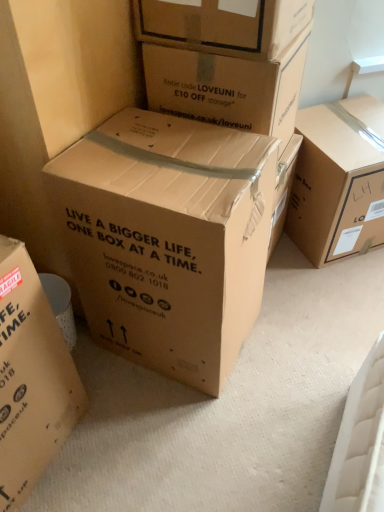
Find the location of a particular element. brown cardboard box at center, which appears as the 6th box when viewed from the right is located at coordinates (31, 378).

Describe the element at coordinates (223, 25) in the screenshot. The width and height of the screenshot is (384, 512). I see `brown cardboard box at upper center, which ranks as the fourth box in left-to-right order` at that location.

Find the location of a particular element. The image size is (384, 512). brown cardboard box at center, placed as the fifth box when sorted from right to left is located at coordinates (57, 102).

Does brown cardboard box at center, the 3th box viewed from the left, have a greater width compared to brown cardboard box at upper right, which is the sixth box in left-to-right order?

Yes.

From the image's perspective, between brown cardboard box at center, the 3th box viewed from the left, and brown cardboard box at upper right, which is the sixth box in left-to-right order, which one is located above?

brown cardboard box at upper right, which is the sixth box in left-to-right order.

This screenshot has width=384, height=512. I want to click on the 1st box above the brown cardboard box at upper right, which is the sixth box in left-to-right order (from a real-world perspective), so click(167, 238).

Is brown cardboard box at center, the 3th box viewed from the left, far away from brown cardboard box at upper right, which is the sixth box in left-to-right order?

No, brown cardboard box at center, the 3th box viewed from the left, is not far away from brown cardboard box at upper right, which is the sixth box in left-to-right order.

Is the surface of brown cardboard box at upper center, the 3th box in the right-to-left sequence, in direct contact with brown cardboard box at upper center, the second box in the right-to-left sequence?

Yes, brown cardboard box at upper center, the 3th box in the right-to-left sequence, is touching brown cardboard box at upper center, the second box in the right-to-left sequence.

Is brown cardboard box at upper center, the 3th box in the right-to-left sequence, wider than brown cardboard box at upper center, the 5th box from the left?

Indeed, brown cardboard box at upper center, the 3th box in the right-to-left sequence, has a greater width compared to brown cardboard box at upper center, the 5th box from the left.

Considering the sizes of objects brown cardboard box at upper center, which ranks as the fourth box in left-to-right order, and brown cardboard box at upper center, the 5th box from the left, in the image provided, who is taller, brown cardboard box at upper center, which ranks as the fourth box in left-to-right order, or brown cardboard box at upper center, the 5th box from the left,?

Standing taller between the two is brown cardboard box at upper center, the 5th box from the left.

From a real-world perspective, is brown cardboard box at upper center, the 3th box in the right-to-left sequence, located higher than brown cardboard box at upper center, the second box in the right-to-left sequence?

Yes, from a real-world perspective, brown cardboard box at upper center, the 3th box in the right-to-left sequence, is on top of brown cardboard box at upper center, the second box in the right-to-left sequence.

From a real-world perspective, count 1st boxs upward from the brown cardboard box at center, the 3th box viewed from the left, and point to it. Please provide its 2D coordinates.

[(31, 378)]

Which is more to the left, brown cardboard box at center, which appears as the 6th box when viewed from the right, or brown cardboard box at center, the 3th box viewed from the left?

brown cardboard box at center, which appears as the 6th box when viewed from the right, is more to the left.

Are brown cardboard box at center, which appears as the 6th box when viewed from the right, and brown cardboard box at center, the fourth box viewed from the right, located far from each other?

No, brown cardboard box at center, which appears as the 6th box when viewed from the right, is not far away from brown cardboard box at center, the fourth box viewed from the right.

Considering the sizes of brown cardboard box at center, which appears as the 6th box when viewed from the right, and brown cardboard box at center, the fourth box viewed from the right, in the image, is brown cardboard box at center, which appears as the 6th box when viewed from the right, bigger or smaller than brown cardboard box at center, the fourth box viewed from the right,?

brown cardboard box at center, which appears as the 6th box when viewed from the right, is smaller than brown cardboard box at center, the fourth box viewed from the right.

From the image's perspective, who appears lower, brown cardboard box at upper center, the 5th box from the left, or brown cardboard box at center, which ranks as the second box in left-to-right order?

From the image's view, brown cardboard box at center, which ranks as the second box in left-to-right order, is below.

Can you confirm if brown cardboard box at upper center, the 5th box from the left, is thinner than brown cardboard box at center, placed as the fifth box when sorted from right to left?

Correct, the width of brown cardboard box at upper center, the 5th box from the left, is less than that of brown cardboard box at center, placed as the fifth box when sorted from right to left.

Based on their positions, is brown cardboard box at upper center, the 5th box from the left, located to the left or right of brown cardboard box at center, which ranks as the second box in left-to-right order?

Clearly, brown cardboard box at upper center, the 5th box from the left, is on the right of brown cardboard box at center, which ranks as the second box in left-to-right order, in the image.

Is brown cardboard box at center, the 3th box viewed from the left, oriented towards brown cardboard box at center, which ranks as the second box in left-to-right order?

No, brown cardboard box at center, the 3th box viewed from the left, is not oriented towards brown cardboard box at center, which ranks as the second box in left-to-right order.

Starting from the brown cardboard box at center, the fourth box viewed from the right, which box is the 1st one in front? Please provide its 2D coordinates.

[(57, 102)]

Considering the positions of points (198, 287) and (14, 141), is point (198, 287) farther from camera compared to point (14, 141)?

No, (198, 287) is in front of (14, 141).

Which of these two, brown cardboard box at center, the 3th box viewed from the left, or brown cardboard box at center, placed as the fifth box when sorted from right to left, is smaller?

brown cardboard box at center, the 3th box viewed from the left.

From the image's perspective, is brown cardboard box at upper center, the 5th box from the left, located beneath brown cardboard box at upper center, the 3th box in the right-to-left sequence?

Correct, brown cardboard box at upper center, the 5th box from the left, appears lower than brown cardboard box at upper center, the 3th box in the right-to-left sequence, in the image.

Does point (171, 67) come behind point (192, 37)?

Yes, it is behind point (192, 37).

Does brown cardboard box at upper center, the 5th box from the left, have a lesser height compared to brown cardboard box at upper center, which ranks as the fourth box in left-to-right order?

No.

Would you say brown cardboard box at upper center, the 5th box from the left, is a long distance from brown cardboard box at upper center, which ranks as the fourth box in left-to-right order?

Actually, brown cardboard box at upper center, the 5th box from the left, and brown cardboard box at upper center, which ranks as the fourth box in left-to-right order, are a little close together.

Between brown cardboard box at center, which appears as the 6th box when viewed from the right, and brown cardboard box at upper right, acting as the first box starting from the right, which one appears on the right side from the viewer's perspective?

Positioned to the right is brown cardboard box at upper right, acting as the first box starting from the right.

From the image's perspective, between brown cardboard box at center, which appears as the 6th box when viewed from the right, and brown cardboard box at upper right, which is the sixth box in left-to-right order, who is located below?

brown cardboard box at center, which appears as the 6th box when viewed from the right.

Does brown cardboard box at center, which is the first box in left-to-right order, have a lesser width compared to brown cardboard box at upper right, acting as the first box starting from the right?

Indeed, brown cardboard box at center, which is the first box in left-to-right order, has a lesser width compared to brown cardboard box at upper right, acting as the first box starting from the right.

Image resolution: width=384 pixels, height=512 pixels. I want to click on the 3rd box counting from the left side of the brown cardboard box at upper right, which is the sixth box in left-to-right order, so click(167, 238).

Where is `box that is the 1st one when counting downward from the brown cardboard box at upper center, which ranks as the fourth box in left-to-right order (from the image's perspective)`? box that is the 1st one when counting downward from the brown cardboard box at upper center, which ranks as the fourth box in left-to-right order (from the image's perspective) is located at coordinates (228, 87).

From the image, which object appears to be nearer to brown cardboard box at upper center, the 3th box in the right-to-left sequence, brown cardboard box at center, the 3th box viewed from the left, or brown cardboard box at upper right, acting as the first box starting from the right?

Among the two, brown cardboard box at center, the 3th box viewed from the left, is located nearer to brown cardboard box at upper center, the 3th box in the right-to-left sequence.

From the image, which object appears to be nearer to brown cardboard box at upper center, the 3th box in the right-to-left sequence, brown cardboard box at center, the 3th box viewed from the left, or brown cardboard box at center, which appears as the 6th box when viewed from the right?

Among the two, brown cardboard box at center, the 3th box viewed from the left, is located nearer to brown cardboard box at upper center, the 3th box in the right-to-left sequence.

Considering their positions, is brown cardboard box at center, the fourth box viewed from the right, positioned further to brown cardboard box at upper center, the second box in the right-to-left sequence, than brown cardboard box at center, which ranks as the second box in left-to-right order?

Based on the image, brown cardboard box at center, the fourth box viewed from the right, appears to be further to brown cardboard box at upper center, the second box in the right-to-left sequence.

Which object lies nearer to the anchor point brown cardboard box at upper center, the 5th box from the left, brown cardboard box at center, which ranks as the second box in left-to-right order, or brown cardboard box at center, which is the first box in left-to-right order?

Based on the image, brown cardboard box at center, which ranks as the second box in left-to-right order, appears to be nearer to brown cardboard box at upper center, the 5th box from the left.

When comparing their distances from brown cardboard box at upper center, the 3th box in the right-to-left sequence, does brown cardboard box at center, which is the first box in left-to-right order, or brown cardboard box at upper right, acting as the first box starting from the right, seem further?

Among the two, brown cardboard box at center, which is the first box in left-to-right order, is located further to brown cardboard box at upper center, the 3th box in the right-to-left sequence.

Estimate the real-world distances between objects in this image. Which object is further from brown cardboard box at upper center, the 5th box from the left, brown cardboard box at center, which appears as the 6th box when viewed from the right, or brown cardboard box at center, placed as the fifth box when sorted from right to left?

Based on the image, brown cardboard box at center, which appears as the 6th box when viewed from the right, appears to be further to brown cardboard box at upper center, the 5th box from the left.

Based on their spatial positions, is brown cardboard box at upper center, the 3th box in the right-to-left sequence, or brown cardboard box at center, the fourth box viewed from the right, closer to brown cardboard box at center, which ranks as the second box in left-to-right order?

Among the two, brown cardboard box at upper center, the 3th box in the right-to-left sequence, is located nearer to brown cardboard box at center, which ranks as the second box in left-to-right order.

Based on the photo, looking at the image, which one is located further to brown cardboard box at upper center, which ranks as the fourth box in left-to-right order, brown cardboard box at upper right, which is the sixth box in left-to-right order, or brown cardboard box at center, the fourth box viewed from the right?

brown cardboard box at upper right, which is the sixth box in left-to-right order.

The height and width of the screenshot is (512, 384). I want to click on box between brown cardboard box at upper center, the 3th box in the right-to-left sequence, and brown cardboard box at upper right, acting as the first box starting from the right, so click(x=228, y=87).